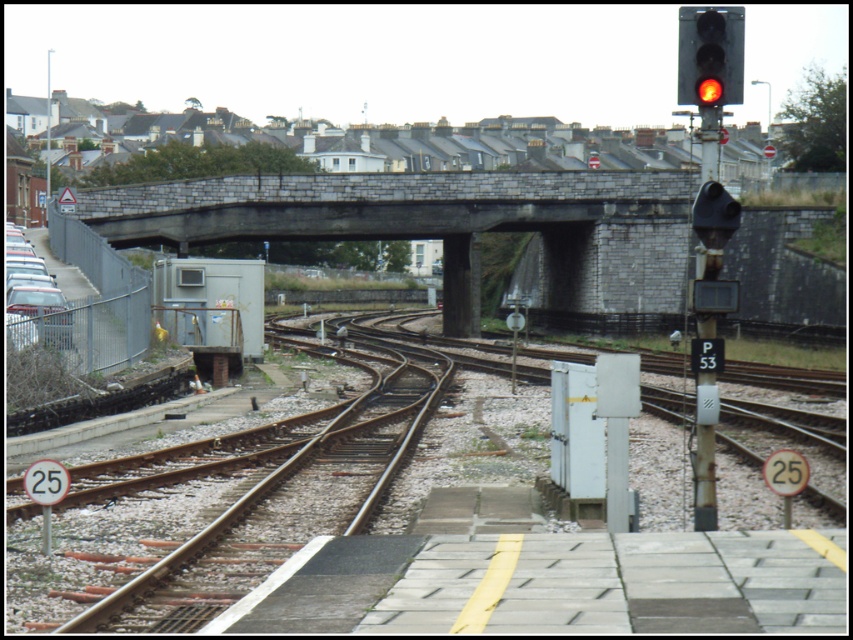
Is metal train track at center taller than stone bridge at center?

No, metal train track at center is not taller than stone bridge at center.

Can you confirm if metal train track at center is shorter than stone bridge at center?

Indeed, metal train track at center has a lesser height compared to stone bridge at center.

Who is more forward, (634, 570) or (659, 216)?

Point (634, 570) is in front.

Where is `metal train track at center`? The image size is (853, 640). metal train track at center is located at coordinates [427, 547].

Can you confirm if stone bridge at center is wider than red glass traffic light at upper right?

Correct, the width of stone bridge at center exceeds that of red glass traffic light at upper right.

Locate an element on the screen. The width and height of the screenshot is (853, 640). stone bridge at center is located at coordinates (399, 218).

Who is shorter, red glass traffic light at upper right or black plastic traffic light at upper right?

With less height is black plastic traffic light at upper right.

Between point (693, 76) and point (718, 205), which one is positioned behind?

Positioned behind is point (718, 205).

Identify the location of red glass traffic light at upper right. (711, 54).

Find the location of a particular element. This screenshot has height=640, width=853. red glass traffic light at upper right is located at coordinates (711, 54).